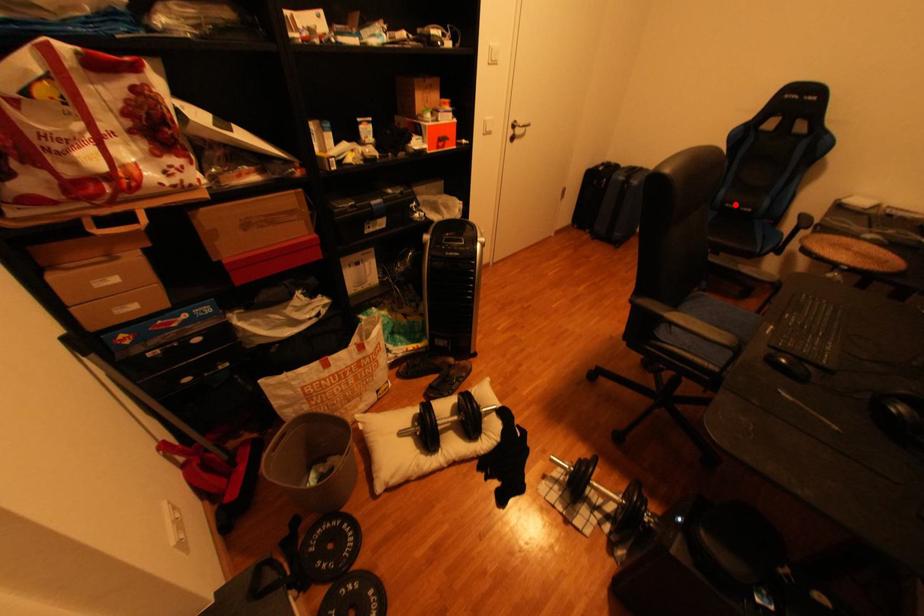
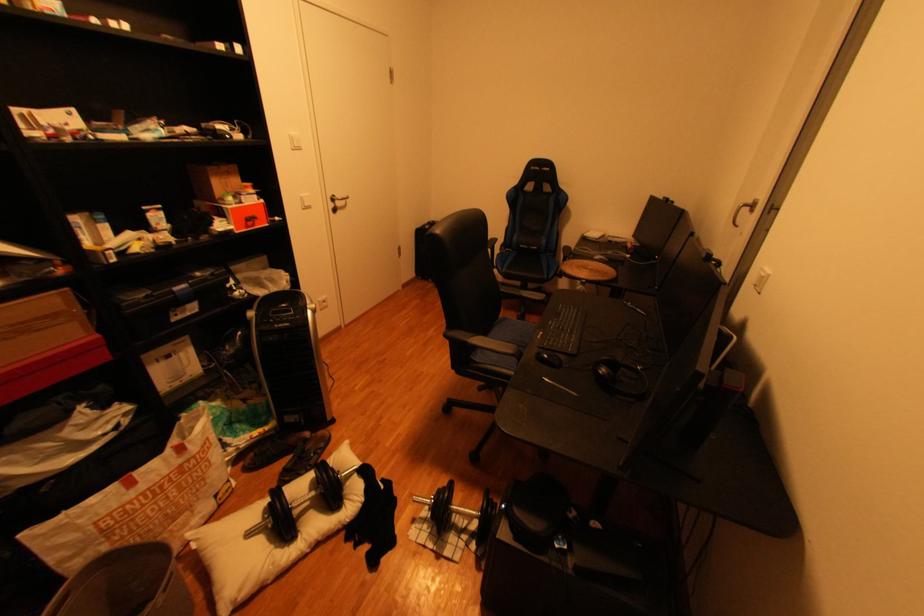
Question: I am providing you with two images of the same scene from different viewpoints. Given a red point in image1, look at the same physical point in image2. Is it:

Choices:
 (A) Closer to the viewpoint
 (B) Farther from the viewpoint

Answer: (A)